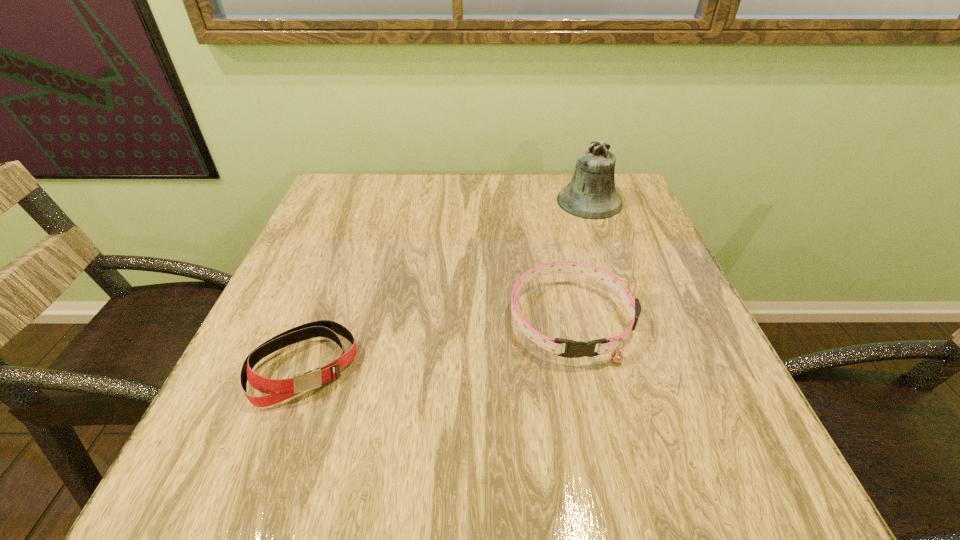
Locate an element on the screen. The height and width of the screenshot is (540, 960). dog collar located at the right edge is located at coordinates coord(574,349).

I want to click on object that is at the far right corner, so click(x=591, y=194).

You are a GUI agent. You are given a task and a screenshot of the screen. Output one action in this format:
    pyautogui.click(x=<x>, y=<y>)
    Task: Click on the free location at the far edge
    
    Given the screenshot: What is the action you would take?
    (x=540, y=180)

Where is `vacant position at the near edge of the desktop`? vacant position at the near edge of the desktop is located at coordinates (404, 454).

In the image, there is a desktop. At what (x,y) coordinates should I click in order to perform the action: click on vacant space at the left edge. Please return your answer as a coordinate pair (x, y). The image size is (960, 540). Looking at the image, I should click on tap(293, 271).

At what (x,y) coordinates should I click in order to perform the action: click on free space at the right edge of the desktop. Please return your answer as a coordinate pair (x, y). The height and width of the screenshot is (540, 960). Looking at the image, I should click on (726, 368).

Where is `blank space at the near left corner`? This screenshot has width=960, height=540. blank space at the near left corner is located at coordinates (289, 472).

Identify the location of vacant space at the near right corner. The height and width of the screenshot is (540, 960). (713, 461).

Locate an element on the screen. vacant area between the farthest object and the right dog collar is located at coordinates (580, 260).

Image resolution: width=960 pixels, height=540 pixels. I want to click on free spot between the farthest object and the right dog collar, so click(580, 260).